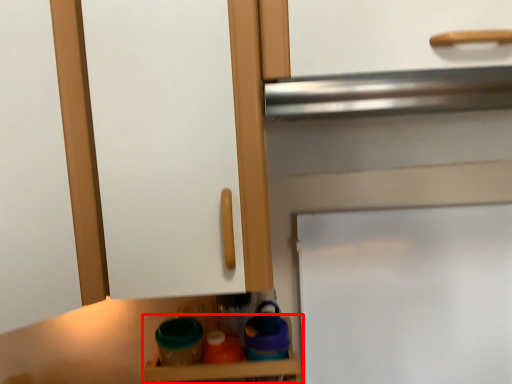
Question: Where is shelf (annotated by the red box) located in relation to door in the image?

Choices:
 (A) right
 (B) left

Answer: (B)